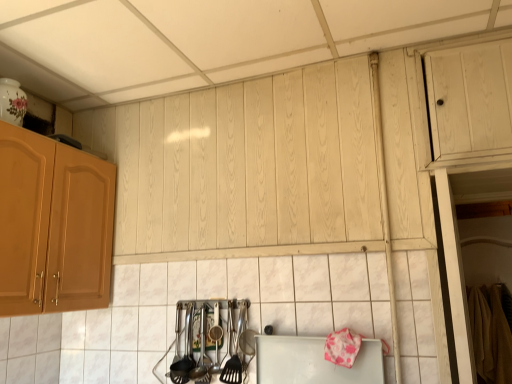
Question: From a real-world perspective, does polished stainless steel utensils at lower center, acting as the second silverware starting from the left, stand above polished metal utensils at lower center, which is the first silverware from left to right?

Choices:
 (A) yes
 (B) no

Answer: (B)

Question: Is polished metal utensils at lower center, the 2th silverware positioned from the right, at the back of polished stainless steel utensils at lower center, the first silverware viewed from the right?

Choices:
 (A) yes
 (B) no

Answer: (B)

Question: Could you tell me if polished stainless steel utensils at lower center, the first silverware viewed from the right, is turned towards polished metal utensils at lower center, which is the first silverware from left to right?

Choices:
 (A) no
 (B) yes

Answer: (A)

Question: Is polished stainless steel utensils at lower center, acting as the second silverware starting from the left, shorter than polished metal utensils at lower center, the 2th silverware positioned from the right?

Choices:
 (A) yes
 (B) no

Answer: (B)

Question: Can you confirm if polished stainless steel utensils at lower center, acting as the second silverware starting from the left, is bigger than polished metal utensils at lower center, which is the first silverware from left to right?

Choices:
 (A) yes
 (B) no

Answer: (A)

Question: Is polished stainless steel utensils at lower center, the first silverware viewed from the right, far from polished metal utensils at lower center, the 2th silverware positioned from the right?

Choices:
 (A) yes
 (B) no

Answer: (B)

Question: From the image's perspective, is polished stainless steel utensils at lower center, acting as the second silverware starting from the left, on top of white matte cutting board at lower center?

Choices:
 (A) yes
 (B) no

Answer: (A)

Question: Is white matte cutting board at lower center a part of polished stainless steel utensils at lower center, the first silverware viewed from the right?

Choices:
 (A) yes
 (B) no

Answer: (B)

Question: Is polished stainless steel utensils at lower center, acting as the second silverware starting from the left, looking in the opposite direction of white matte cutting board at lower center?

Choices:
 (A) no
 (B) yes

Answer: (A)

Question: Can you confirm if polished stainless steel utensils at lower center, the first silverware viewed from the right, is shorter than white matte cutting board at lower center?

Choices:
 (A) yes
 (B) no

Answer: (B)

Question: Can you confirm if polished stainless steel utensils at lower center, acting as the second silverware starting from the left, is smaller than white matte cutting board at lower center?

Choices:
 (A) yes
 (B) no

Answer: (B)

Question: Does polished stainless steel utensils at lower center, the first silverware viewed from the right, appear on the right side of white matte cutting board at lower center?

Choices:
 (A) no
 (B) yes

Answer: (A)

Question: Is white glossy tile at center to the left of white matte cutting board at lower center from the viewer's perspective?

Choices:
 (A) no
 (B) yes

Answer: (B)